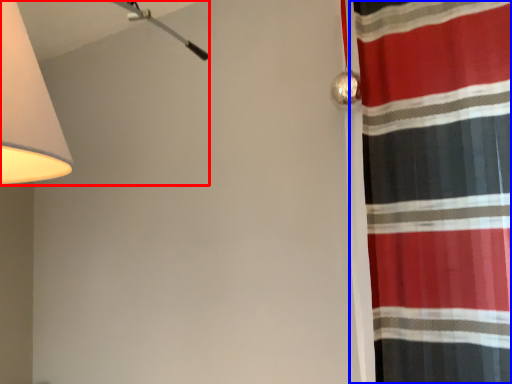
Question: Which object appears closest to the camera in this image, lamp (highlighted by a red box) or curtain (highlighted by a blue box)?

Choices:
 (A) lamp
 (B) curtain

Answer: (A)